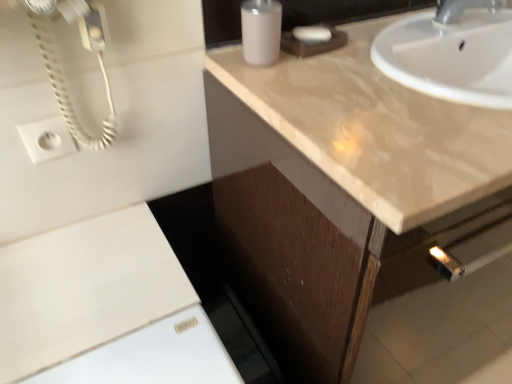
Where is `matte plastic soap dispenser at upper center`? matte plastic soap dispenser at upper center is located at coordinates [x=261, y=31].

What do you see at coordinates (47, 139) in the screenshot? I see `white plastic outlet at upper left` at bounding box center [47, 139].

You are a GUI agent. You are given a task and a screenshot of the screen. Output one action in this format:
    pyautogui.click(x=<x>, y=<y>)
    Task: Click on the white matte soap at upper center
    This screenshot has height=384, width=512.
    Given the screenshot: What is the action you would take?
    pyautogui.click(x=312, y=34)

This screenshot has width=512, height=384. What do you see at coordinates (302, 242) in the screenshot?
I see `matte brown cabinet at upper right` at bounding box center [302, 242].

Measure the distance between white matte cabinet at lower left and camera.

25.14 inches.

The width and height of the screenshot is (512, 384). I want to click on matte plastic soap dispenser at upper center, so click(261, 31).

Which object is wider, matte brown cabinet at upper right or white matte cabinet at lower left?

matte brown cabinet at upper right is wider.

Locate an element on the screen. This screenshot has width=512, height=384. bathroom cabinet on the right side of white matte cabinet at lower left is located at coordinates (302, 242).

Would you say matte brown cabinet at upper right is a long distance from white matte cabinet at lower left?

They are positioned close to each other.

Does matte brown cabinet at upper right turn towards white matte cabinet at lower left?

No, matte brown cabinet at upper right is not turned towards white matte cabinet at lower left.

Is the depth of white matte cabinet at lower left less than that of white plastic outlet at upper left?

Yes, white matte cabinet at lower left is closer to the viewer.

Is white matte cabinet at lower left in contact with white plastic outlet at upper left?

white matte cabinet at lower left is not next to white plastic outlet at upper left, and they're not touching.

From the picture: From the image's perspective, who appears lower, white matte cabinet at lower left or white plastic outlet at upper left?

white matte cabinet at lower left.

Which object is positioned more to the left, matte brown cabinet at upper right or glossy beige countertop at upper right?

glossy beige countertop at upper right.

Looking at this image, in the image, is matte brown cabinet at upper right positioned in front of or behind glossy beige countertop at upper right?

Clearly, matte brown cabinet at upper right is behind glossy beige countertop at upper right.

The image size is (512, 384). What are the coordinates of `bathroom cabinet lying on the right of glossy beige countertop at upper right` in the screenshot? It's located at (302, 242).

Is matte brown cabinet at upper right oriented towards glossy beige countertop at upper right?

No, matte brown cabinet at upper right is not turned towards glossy beige countertop at upper right.

Is glossy beige countertop at upper right not close to matte brown cabinet at upper right?

No, glossy beige countertop at upper right is in close proximity to matte brown cabinet at upper right.

Between glossy beige countertop at upper right and matte brown cabinet at upper right, which one has smaller width?

Thinner between the two is glossy beige countertop at upper right.

Is glossy beige countertop at upper right facing towards matte brown cabinet at upper right?

No, glossy beige countertop at upper right is not aimed at matte brown cabinet at upper right.

From a real-world perspective, is white matte cabinet at lower left on top of matte brown cabinet at upper right?

Yes, from a real-world perspective, white matte cabinet at lower left is on top of matte brown cabinet at upper right.

Could matte brown cabinet at upper right be considered to be inside white matte cabinet at lower left?

No, matte brown cabinet at upper right is not a part of white matte cabinet at lower left.

Are white matte cabinet at lower left and matte brown cabinet at upper right far apart?

That's not correct — white matte cabinet at lower left is a little close to matte brown cabinet at upper right.

Could you tell me if white matte cabinet at lower left is facing matte brown cabinet at upper right?

No, white matte cabinet at lower left does not turn towards matte brown cabinet at upper right.

From a real-world perspective, is glossy beige countertop at upper right beneath white matte soap at upper center?

Yes.

Is glossy beige countertop at upper right directly adjacent to white matte soap at upper center?

glossy beige countertop at upper right is not next to white matte soap at upper center, and they're not touching.

Is glossy beige countertop at upper right oriented towards white matte soap at upper center?

No, glossy beige countertop at upper right is not turned towards white matte soap at upper center.

Who is shorter, glossy beige countertop at upper right or white matte soap at upper center?

Standing shorter between the two is white matte soap at upper center.

Which object is wider, white plastic outlet at upper left or matte brown cabinet at upper right?

Wider between the two is matte brown cabinet at upper right.

Is matte brown cabinet at upper right located within white plastic outlet at upper left?

No, matte brown cabinet at upper right is not inside white plastic outlet at upper left.

From a real-world perspective, is white plastic outlet at upper left over matte brown cabinet at upper right?

Yes, from a real-world perspective, white plastic outlet at upper left is on top of matte brown cabinet at upper right.

Could you tell me if white plastic outlet at upper left is facing matte brown cabinet at upper right?

No.

Where is `bathroom cabinet lying on the right of white matte cabinet at lower left`? This screenshot has width=512, height=384. bathroom cabinet lying on the right of white matte cabinet at lower left is located at coordinates (302, 242).

I want to click on electric outlet behind the white matte cabinet at lower left, so [47, 139].

Looking at the image, which one is located further to matte plastic soap dispenser at upper center, matte brown cabinet at upper right or white plastic outlet at upper left?

white plastic outlet at upper left lies further to matte plastic soap dispenser at upper center than the other object.

Based on their spatial positions, is glossy beige countertop at upper right or matte brown cabinet at upper right closer to matte plastic soap dispenser at upper center?

glossy beige countertop at upper right lies closer to matte plastic soap dispenser at upper center than the other object.

Based on their spatial positions, is white matte cabinet at lower left or matte plastic soap dispenser at upper center closer to white matte soap at upper center?

Based on the image, matte plastic soap dispenser at upper center appears to be nearer to white matte soap at upper center.

When comparing their distances from white matte cabinet at lower left, does white matte soap at upper center or matte brown cabinet at upper right seem further?

Among the two, white matte soap at upper center is located further to white matte cabinet at lower left.

Which object lies further to the anchor point white plastic outlet at upper left, glossy beige countertop at upper right or matte plastic soap dispenser at upper center?

glossy beige countertop at upper right is positioned further to the anchor white plastic outlet at upper left.

Which object lies nearer to the anchor point white plastic outlet at upper left, matte brown cabinet at upper right or glossy beige countertop at upper right?

The object closer to white plastic outlet at upper left is matte brown cabinet at upper right.

From the image, which object appears to be farther from white matte soap at upper center, white plastic outlet at upper left or glossy beige countertop at upper right?

white plastic outlet at upper left is positioned further to the anchor white matte soap at upper center.

Based on their spatial positions, is white matte cabinet at lower left or white plastic outlet at upper left further from matte brown cabinet at upper right?

→ The object further to matte brown cabinet at upper right is white plastic outlet at upper left.

What are the coordinates of `soap situated between matte plastic soap dispenser at upper center and glossy beige countertop at upper right from left to right` in the screenshot? It's located at (312, 34).

Where is `soap dispenser situated between white matte cabinet at lower left and glossy beige countertop at upper right from left to right`? The height and width of the screenshot is (384, 512). soap dispenser situated between white matte cabinet at lower left and glossy beige countertop at upper right from left to right is located at coordinates (261, 31).

Locate an element on the screen. The height and width of the screenshot is (384, 512). soap between white matte cabinet at lower left and glossy beige countertop at upper right in the horizontal direction is located at coordinates (312, 34).

This screenshot has width=512, height=384. Find the location of `soap dispenser between white plastic outlet at upper left and matte brown cabinet at upper right in the horizontal direction`. soap dispenser between white plastic outlet at upper left and matte brown cabinet at upper right in the horizontal direction is located at coordinates click(261, 31).